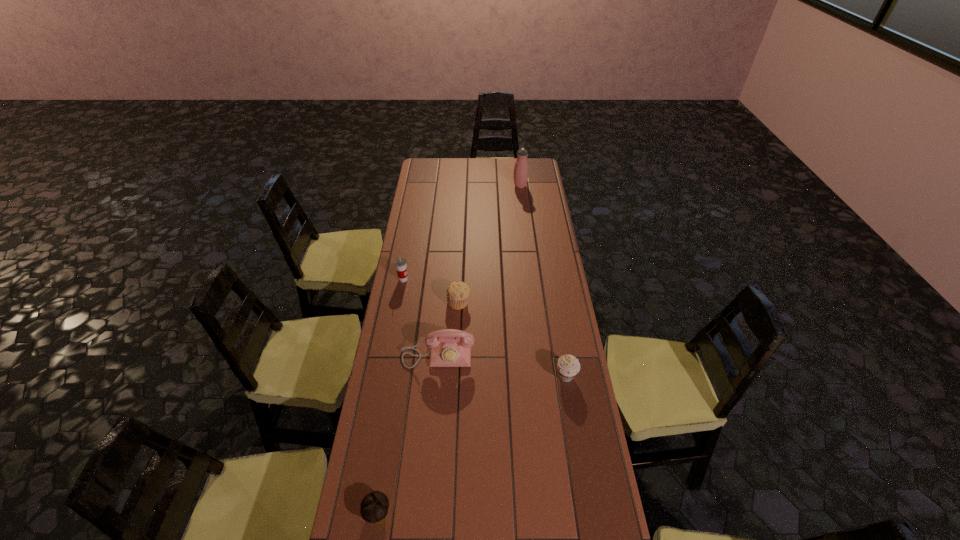
The height and width of the screenshot is (540, 960). In order to click on vacant space that's between the second farthest object and the telephone in this screenshot , I will do `click(420, 318)`.

Find the location of a particular element. blank region between the second farthest muffin and the second muffin from left to right is located at coordinates point(513,339).

Locate an element on the screen. vacant area between the tallest object and the telephone is located at coordinates (479, 271).

Choose which object is the fourth nearest neighbor to the second farthest muffin. Please provide its 2D coordinates. Your answer should be formatted as a tuple, i.e. [(x, y)], where the tuple contains the x and y coordinates of a point satisfying the conditions above.

[(400, 263)]

Locate which object is the fourth closest to the telephone. Please provide its 2D coordinates. Your answer should be formatted as a tuple, i.e. [(x, y)], where the tuple contains the x and y coordinates of a point satisfying the conditions above.

[(374, 507)]

What are the coordinates of `muffin object that ranks as the second closest to the rightmost object` in the screenshot? It's located at (374, 507).

Locate an element on the screen. muffin that can be found as the closest to the farthest object is located at coordinates (458, 292).

Identify the location of free space that satisfies the following two spatial constraints: 1. on the back side of the fourth nearest object; 2. on the right side of the nearest muffin. (410, 302).

At what (x,y) coordinates should I click in order to perform the action: click on vacant area in the image that satisfies the following two spatial constraints: 1. on the back side of the second muffin from right to left; 2. on the side of the cup with the logo. Please return your answer as a coordinate pair (x, y). This screenshot has width=960, height=540. Looking at the image, I should click on (460, 279).

At what (x,y) coordinates should I click in order to perform the action: click on free space that satisfies the following two spatial constraints: 1. on the side of the rightmost muffin with the logo; 2. on the right side of the fifth nearest object. Please return your answer as a coordinate pair (x, y). Image resolution: width=960 pixels, height=540 pixels. Looking at the image, I should click on pyautogui.click(x=386, y=376).